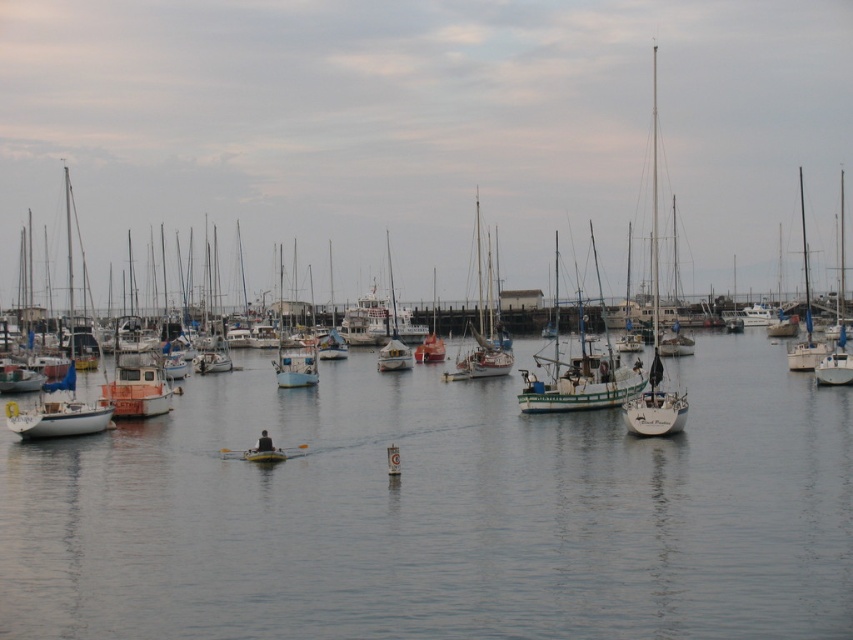
Which is behind, point (129, 515) or point (654, 298)?

Point (654, 298)

Image resolution: width=853 pixels, height=640 pixels. Describe the element at coordinates (440, 513) in the screenshot. I see `clear water at center` at that location.

The height and width of the screenshot is (640, 853). What do you see at coordinates (440, 513) in the screenshot?
I see `clear water at center` at bounding box center [440, 513].

Identify the location of clear water at center. Image resolution: width=853 pixels, height=640 pixels. (440, 513).

Does white wooden sailboat at center have a greater height compared to white matte sailboat at right?

In fact, white wooden sailboat at center may be shorter than white matte sailboat at right.

Can you confirm if white wooden sailboat at center is shorter than white matte sailboat at right?

Indeed, white wooden sailboat at center has a lesser height compared to white matte sailboat at right.

Image resolution: width=853 pixels, height=640 pixels. Describe the element at coordinates (581, 376) in the screenshot. I see `white wooden sailboat at center` at that location.

Locate an element on the screen. The image size is (853, 640). white wooden sailboat at center is located at coordinates (581, 376).

Who is shorter, clear water at center or white wooden sailboat at center?

With less height is clear water at center.

Between clear water at center and white wooden sailboat at center, which one is positioned lower?

clear water at center is lower down.

The width and height of the screenshot is (853, 640). Identify the location of clear water at center. (440, 513).